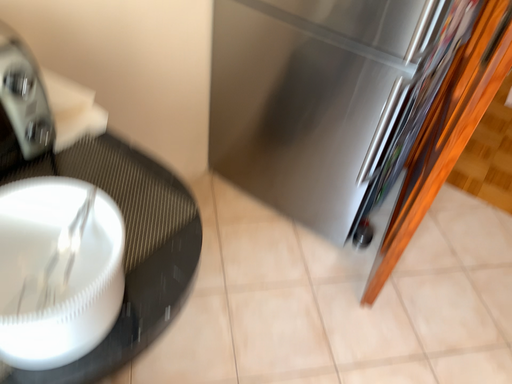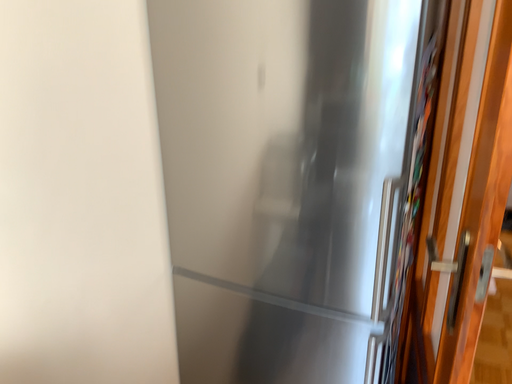
Question: How did the camera likely rotate when shooting the video?

Choices:
 (A) rotated downward
 (B) rotated upward

Answer: (B)